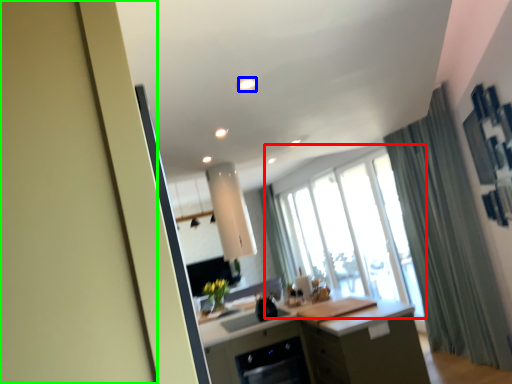
Question: Which is farther away from window (highlighted by a red box)? light (highlighted by a blue box) or screen door (highlighted by a green box)?

Choices:
 (A) light
 (B) screen door

Answer: (B)